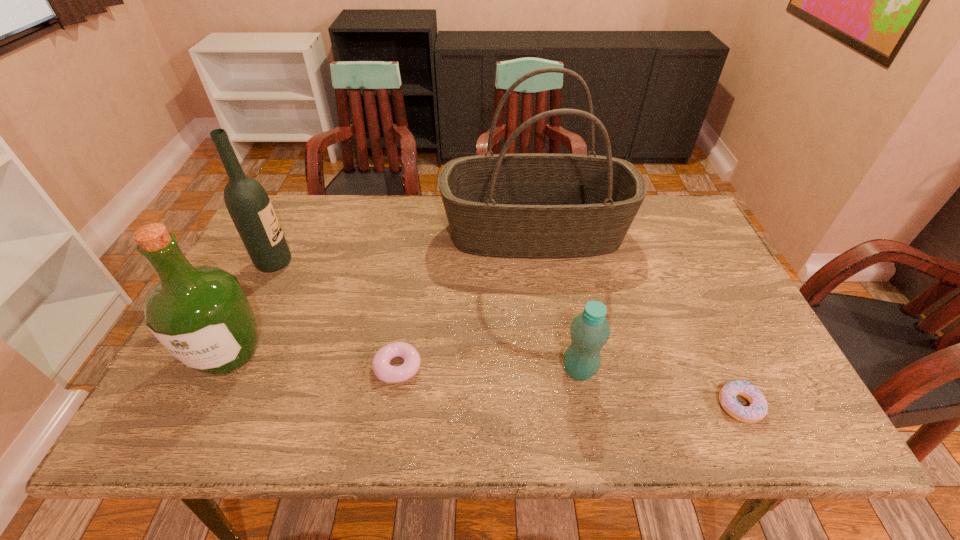
Find the location of a particular element. This screenshot has height=540, width=960. blank space that satisfies the following two spatial constraints: 1. on the front-facing side of the liquor; 2. on the right side of the fourth object from right to left is located at coordinates (222, 367).

At what (x,y) coordinates should I click in order to perform the action: click on free spot that satisfies the following two spatial constraints: 1. on the labeled side of the wine bottle; 2. on the left side of the fourth object from right to left. Please return your answer as a coordinate pair (x, y). This screenshot has width=960, height=540. Looking at the image, I should click on (225, 367).

Where is `free space that satisfies the following two spatial constraints: 1. on the labeled side of the wine bottle; 2. on the front-facing side of the liquor`? free space that satisfies the following two spatial constraints: 1. on the labeled side of the wine bottle; 2. on the front-facing side of the liquor is located at coordinates (231, 353).